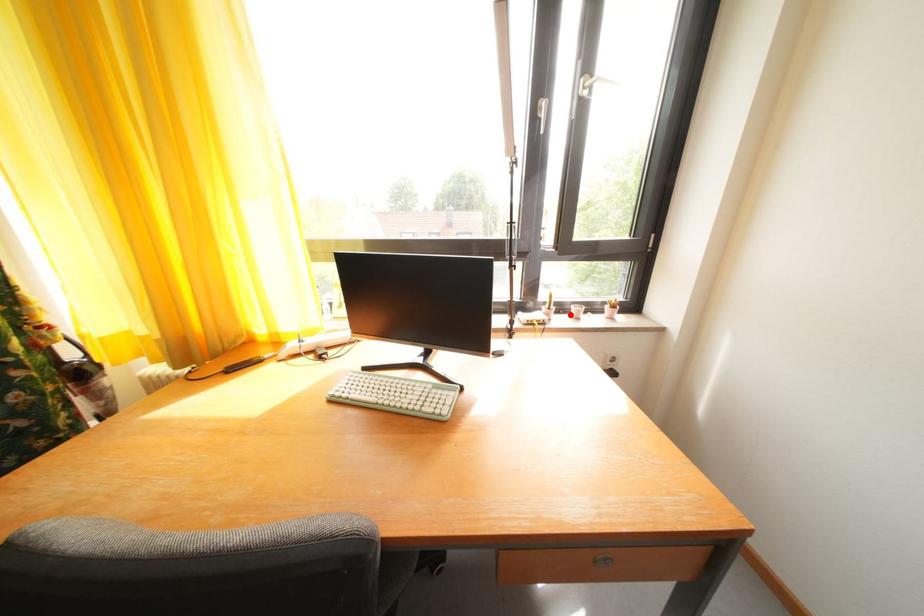
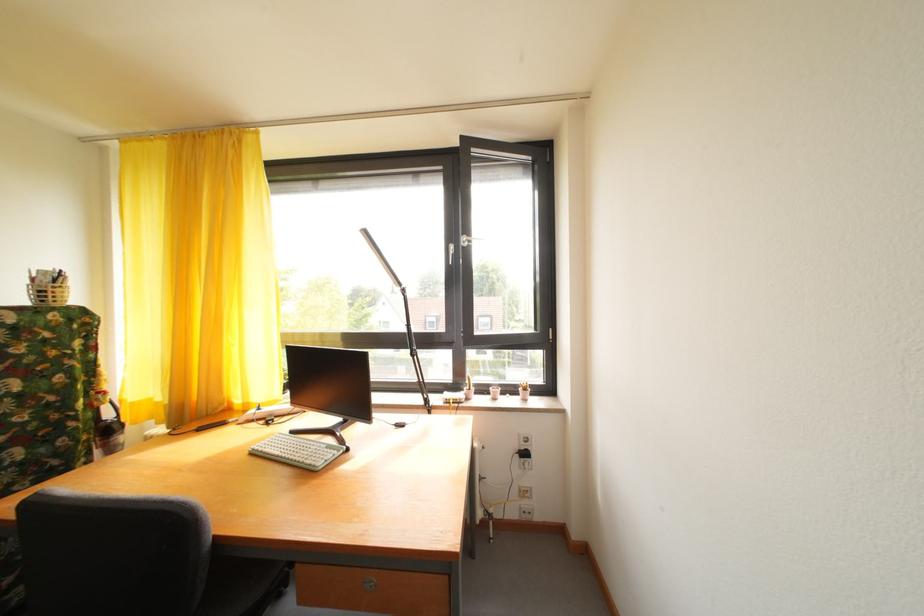
Find the pixel in the second image that matches the highlighted location in the first image.

(492, 395)